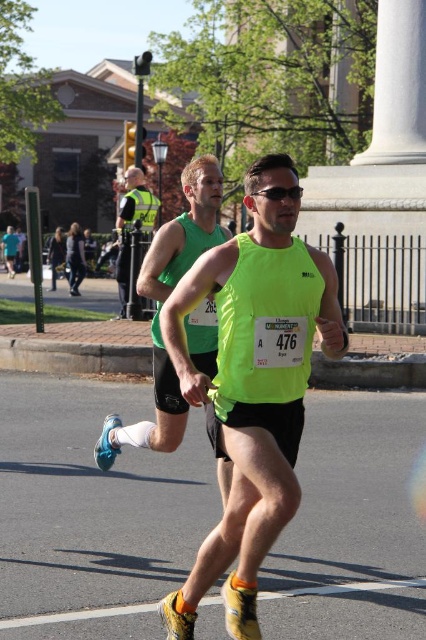
Question: Can you confirm if neon yellow tank top at center is positioned to the left of neon green tank top at center?

Choices:
 (A) yes
 (B) no

Answer: (B)

Question: Which object appears closest to the camera in this image?

Choices:
 (A) neon green tank top at center
 (B) neon yellow tank top at center

Answer: (B)

Question: Can you confirm if neon yellow tank top at center is positioned to the left of neon green tank top at center?

Choices:
 (A) no
 (B) yes

Answer: (A)

Question: Which of the following is the closest to the observer?

Choices:
 (A) (229, 465)
 (B) (192, 390)
 (C) (129, 195)

Answer: (B)

Question: Which point is closer to the camera?

Choices:
 (A) reflective yellow vest at center
 (B) neon green tank top at center

Answer: (B)

Question: Where is neon yellow tank top at center located in relation to neon green tank top at center in the image?

Choices:
 (A) above
 (B) below

Answer: (B)